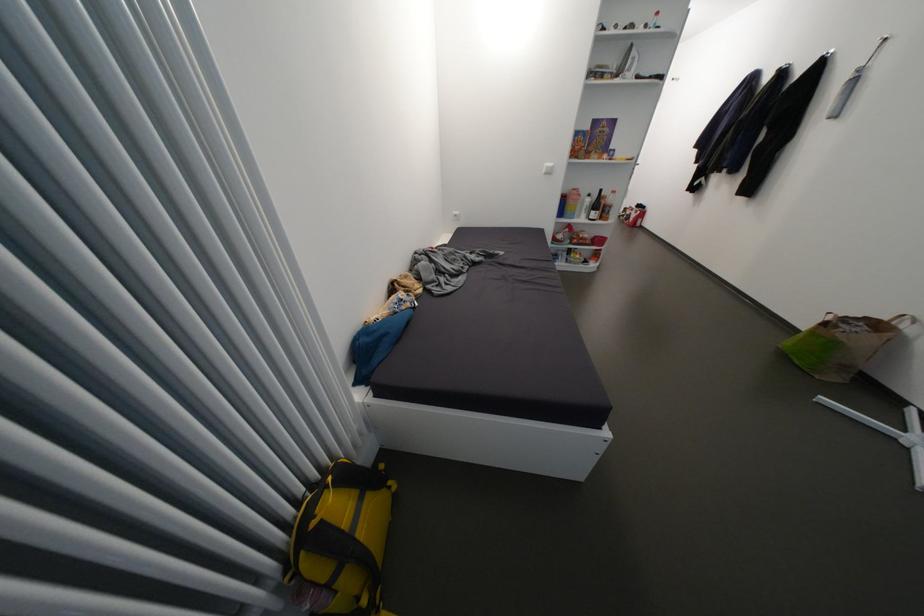
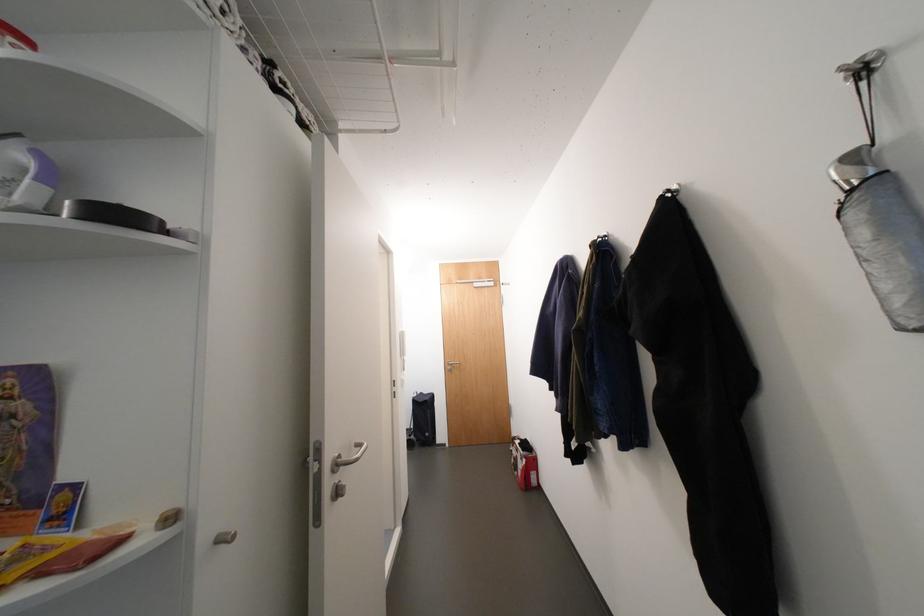
Locate, in the second image, the point that corresponds to [638,220] in the first image.

(527, 474)